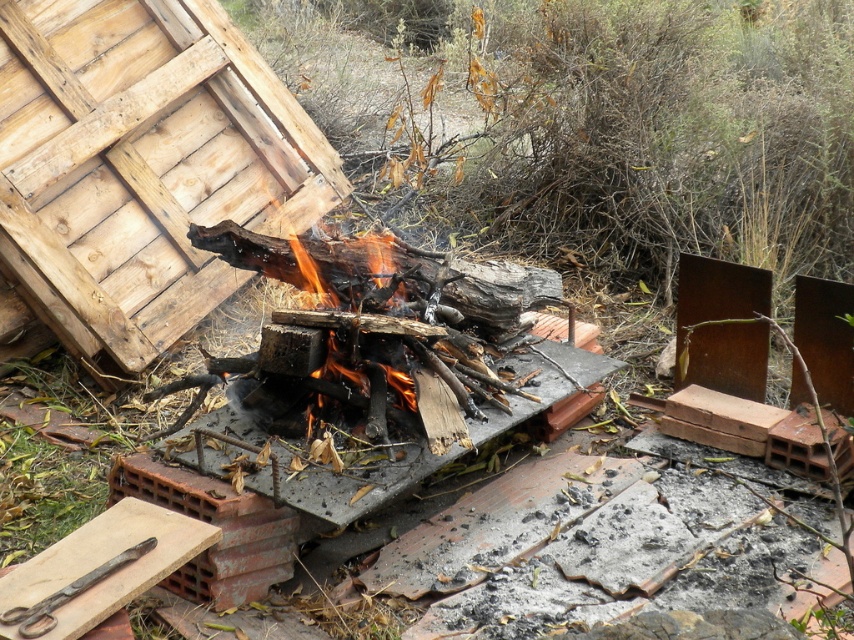
You are a delivery person trying to place a package that is 3 meters long between the weathered wood hut at upper left and the black metal scissors at lower left. Can you fit the package between them without moving either object?

The distance between the weathered wood hut at upper left and the black metal scissors at lower left is 2.57 meters, which is shorter than the 3 meters length of the package. Therefore, the package cannot be placed between them without moving either object.

You are standing at the fire pit and want to move towards the two points marked in the scene. According to their positions, which point, point (92, 72) or point (80, 582), is farther away from your current position?

Point (92, 72) is farther away from the fire pit than point (80, 582) because it is positioned behind the latter.

You are standing in the outdoor scene with the fire pit. You see a point marked at coordinates (141, 164). Which object does this point belong to?

The point at coordinates (141, 164) is on the weathered wood hut at upper left.